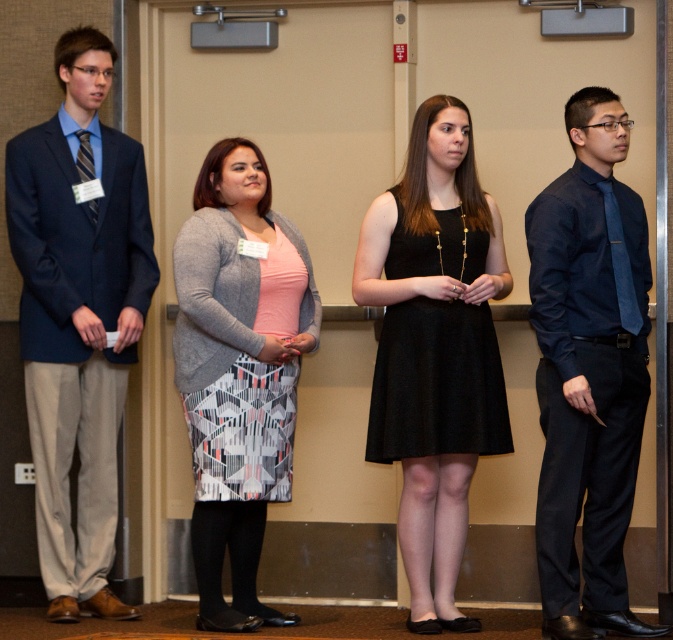
Question: Is the position of black satin dress at center more distant than that of navy blue shirt at right?

Choices:
 (A) yes
 (B) no

Answer: (A)

Question: Which object is the closest to the matte blue suit at left?

Choices:
 (A) gray textured cardigan at center
 (B) black satin dress at center
 (C) navy blue shirt at right

Answer: (A)

Question: Based on their relative distances, which object is farther from the black matte dress at center?

Choices:
 (A) gray textured cardigan at center
 (B) matte blue suit at left
 (C) black satin dress at center
 (D) navy blue shirt at right

Answer: (B)

Question: Which of the following is the closest to the observer?

Choices:
 (A) (487, 387)
 (B) (431, 465)
 (C) (227, 630)
 (D) (98, 380)

Answer: (A)

Question: Is the position of matte blue suit at left more distant than that of navy blue shirt at right?

Choices:
 (A) no
 (B) yes

Answer: (B)

Question: Is matte blue suit at left above gray textured cardigan at center?

Choices:
 (A) yes
 (B) no

Answer: (A)